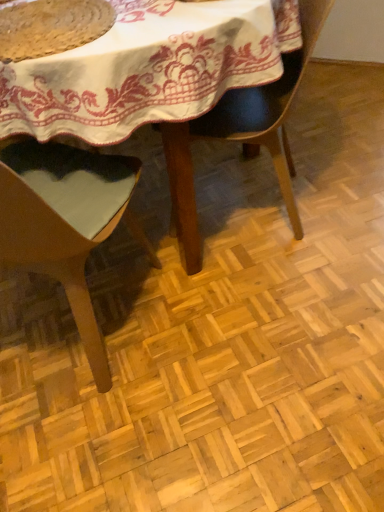
Question: From a real-world perspective, is wooden table at center physically located above or below rustic woven mat at upper left?

Choices:
 (A) below
 (B) above

Answer: (A)

Question: From the image's perspective, is wooden table at center above or below rustic woven mat at upper left?

Choices:
 (A) below
 (B) above

Answer: (B)

Question: Which object is the farthest from the matte black chair at center, placed as the first chair when sorted from right to left?

Choices:
 (A) wooden table at center
 (B) light brown wood chair at center, which ranks as the 1th chair in left-to-right order
 (C) rustic woven mat at upper left

Answer: (C)

Question: Which of these objects is positioned closest to the wooden table at center?

Choices:
 (A) light brown wood chair at center, which ranks as the 1th chair in left-to-right order
 (B) matte black chair at center, the 2th chair in the left-to-right sequence
 (C) rustic woven mat at upper left

Answer: (B)